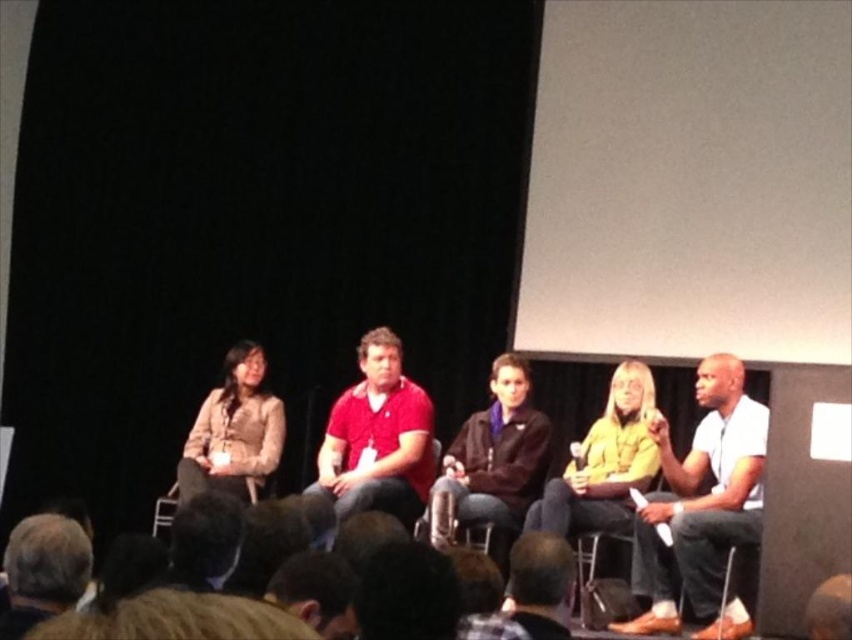
Which of these two, dark blue jacket at center or brown hair at lower left, stands shorter?

Standing shorter between the two is brown hair at lower left.

Is dark blue jacket at center to the left of brown hair at lower left from the viewer's perspective?

In fact, dark blue jacket at center is to the right of brown hair at lower left.

Which is behind, point (508, 406) or point (73, 576)?

Positioned behind is point (508, 406).

I want to click on dark blue jacket at center, so click(491, 458).

Does point (645, 516) lie behind point (249, 364)?

No.

The image size is (852, 640). I want to click on white matte shirt at right, so [x=701, y=508].

Who is positioned more to the left, white matte shirt at right or yellow matte jacket at center?

yellow matte jacket at center is more to the left.

Does white matte shirt at right appear on the left side of yellow matte jacket at center?

In fact, white matte shirt at right is to the right of yellow matte jacket at center.

Based on the photo, who is more forward, (697,444) or (634,417)?

Point (697,444)

Locate an element on the screen. Image resolution: width=852 pixels, height=640 pixels. white matte shirt at right is located at coordinates (701, 508).